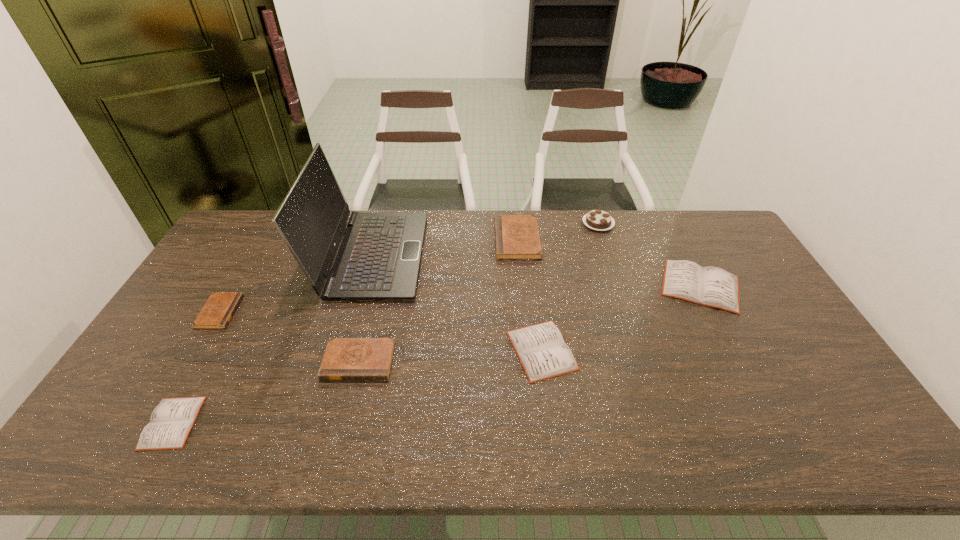
Where is `object that is positioned at the right edge`? object that is positioned at the right edge is located at coordinates (711, 286).

Image resolution: width=960 pixels, height=540 pixels. I want to click on object located in the near left corner section of the desktop, so click(x=171, y=421).

This screenshot has height=540, width=960. In the image, there is a desktop. What are the coordinates of `vacant space at the far edge` in the screenshot? It's located at (568, 238).

Find the location of a particular element. The width and height of the screenshot is (960, 540). vacant space at the near edge is located at coordinates (397, 446).

In the image, there is a desktop. At what (x,y) coordinates should I click in order to perform the action: click on vacant space at the left edge. Please return your answer as a coordinate pair (x, y). Looking at the image, I should click on (203, 333).

The image size is (960, 540). What are the coordinates of `vacant space at the right edge of the desktop` in the screenshot? It's located at (794, 336).

Where is `vacant region at the far right corner of the desktop`? This screenshot has width=960, height=540. vacant region at the far right corner of the desktop is located at coordinates pyautogui.click(x=705, y=233).

Find the location of a particular element. vacant area that lies between the second farthest brown diary and the rightmost object is located at coordinates (460, 299).

Where is `vacant region between the biggest white diary and the second farthest white diary`? The image size is (960, 540). vacant region between the biggest white diary and the second farthest white diary is located at coordinates click(621, 318).

The width and height of the screenshot is (960, 540). Identify the location of free space between the second farthest white diary and the chocolate cake. click(x=570, y=287).